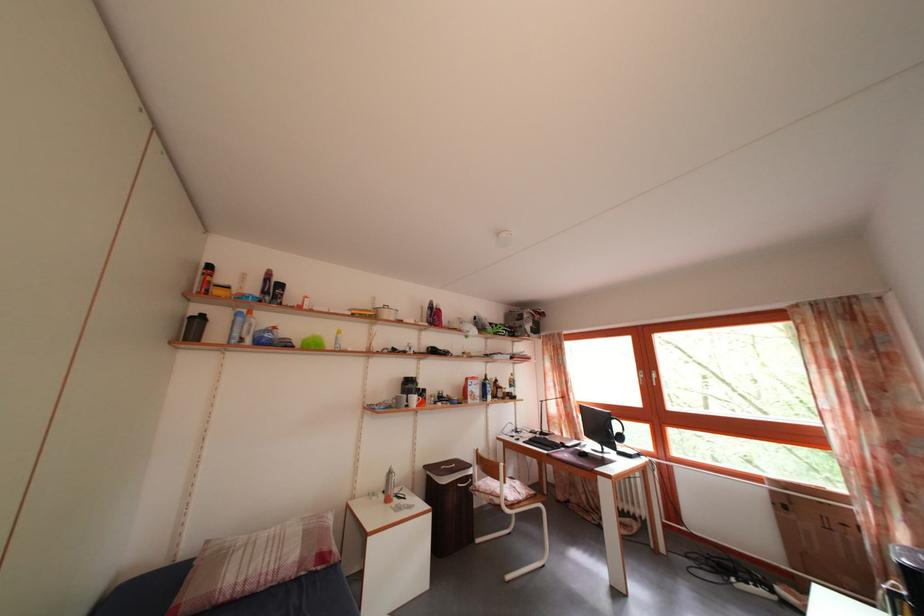
Where would you slid the computer mouse? Please return your answer as a coordinate pair (x, y).

(582, 453)